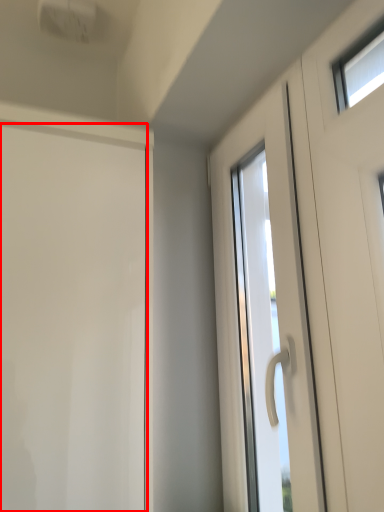
Question: From the image's perspective, where is door (annotated by the red box) located relative to door?

Choices:
 (A) above
 (B) below

Answer: (B)